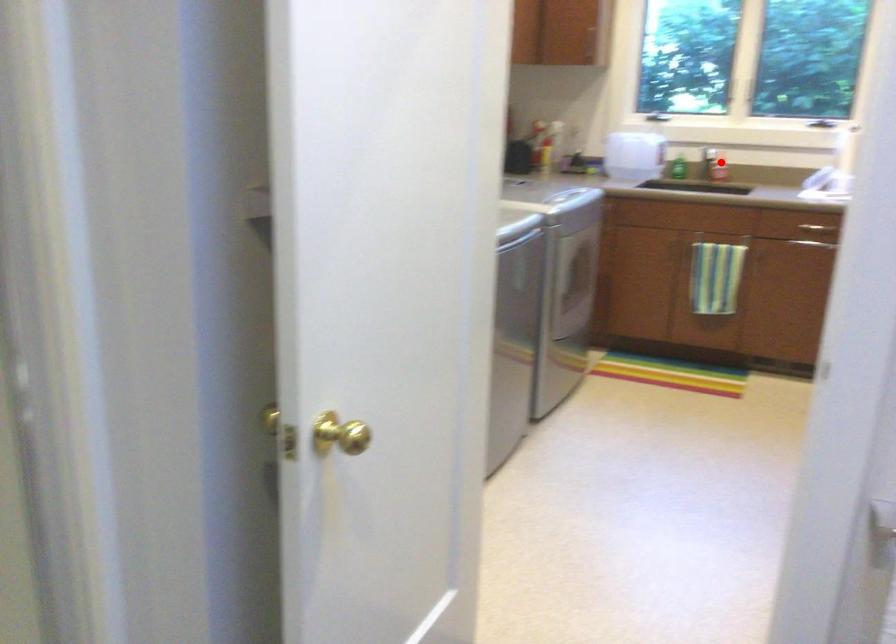
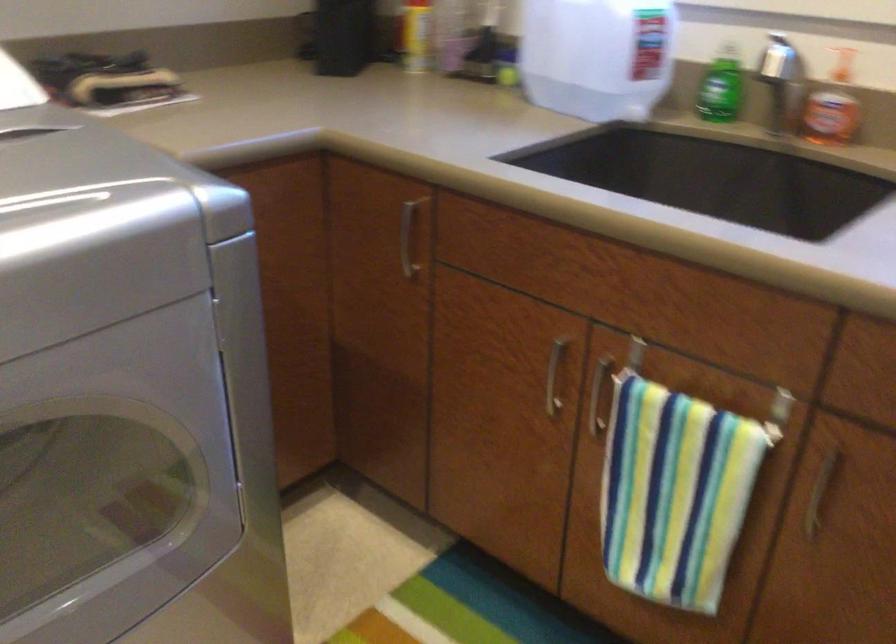
The point at the highlighted location is marked in the first image. Where is the corresponding point in the second image?

(832, 106)